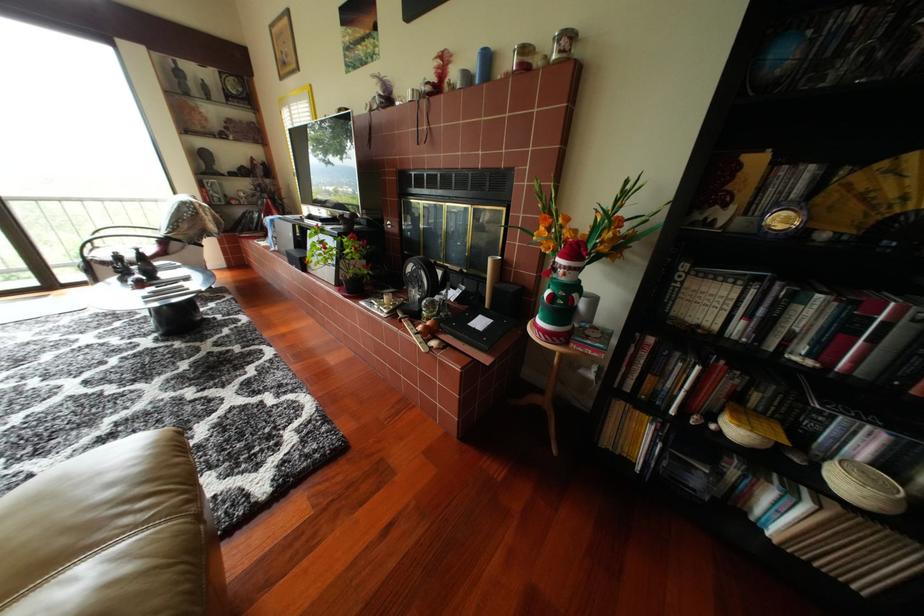
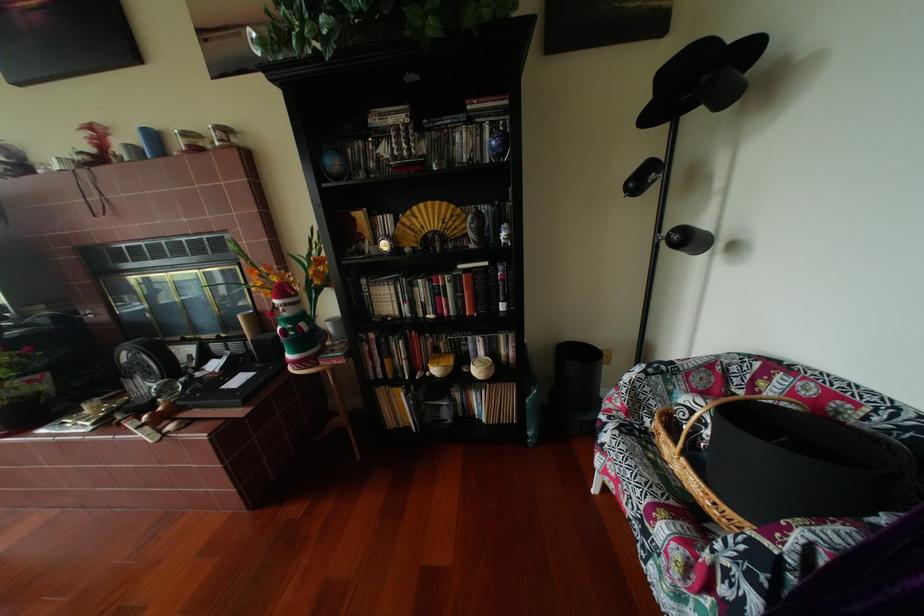
Find the pixel in the second image that matches (x=430, y=334) in the first image.

(152, 429)